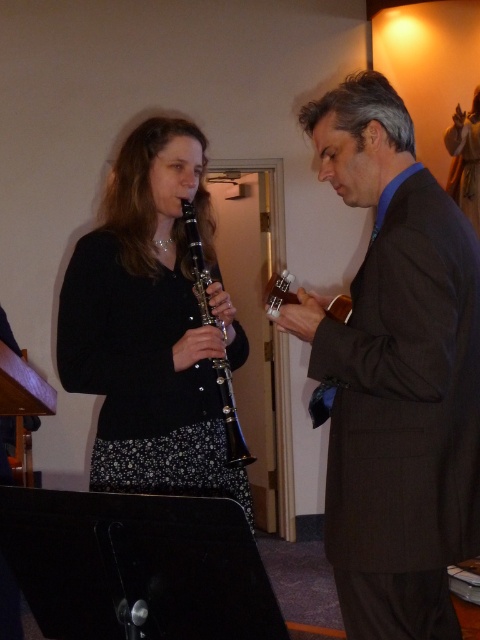
At what (x,y) coordinates should I click in order to perform the action: click on brown wool suit at right. Please return your answer as a coordinate pair (x, y). The image size is (480, 640). Looking at the image, I should click on (395, 374).

Is brown wool suit at right below black matte clarinet at center?

Yes.

Who is more distant from viewer, (420, 241) or (223, 403)?

The point (223, 403) is behind.

The height and width of the screenshot is (640, 480). Find the location of `brown wool suit at right`. brown wool suit at right is located at coordinates (395, 374).

The image size is (480, 640). What do you see at coordinates (151, 326) in the screenshot?
I see `black glossy clarinet at center` at bounding box center [151, 326].

Where is `black glossy clarinet at center`? black glossy clarinet at center is located at coordinates (151, 326).

Is point (450, 608) behind point (203, 202)?

No.

Identify the location of brown wool suit at right. (395, 374).